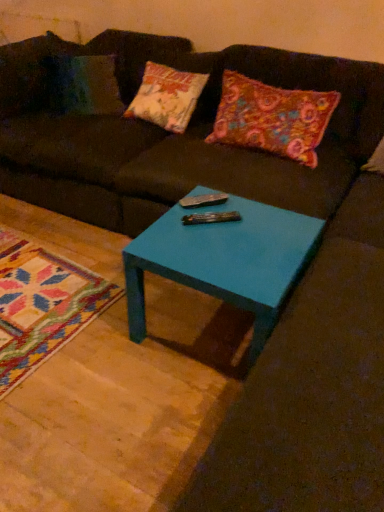
Question: From a real-world perspective, is metallic silver remote at center located beneath matte brown couch at center?

Choices:
 (A) yes
 (B) no

Answer: (B)

Question: Is metallic silver remote at center turned away from matte brown couch at center?

Choices:
 (A) yes
 (B) no

Answer: (A)

Question: Is there a large distance between metallic silver remote at center and matte brown couch at center?

Choices:
 (A) yes
 (B) no

Answer: (B)

Question: From the image's perspective, would you say metallic silver remote at center is shown under matte brown couch at center?

Choices:
 (A) no
 (B) yes

Answer: (B)

Question: Is metallic silver remote at center smaller than matte brown couch at center?

Choices:
 (A) yes
 (B) no

Answer: (A)

Question: Is point (165, 153) closer or farther from the camera than point (135, 266)?

Choices:
 (A) farther
 (B) closer

Answer: (A)

Question: Looking at their shapes, would you say matte brown couch at center is wider or thinner than teal glossy table at center?

Choices:
 (A) wide
 (B) thin

Answer: (A)

Question: From the image's perspective, is matte brown couch at center located above or below teal glossy table at center?

Choices:
 (A) above
 (B) below

Answer: (A)

Question: Is matte brown couch at center in front of or behind teal glossy table at center in the image?

Choices:
 (A) front
 (B) behind

Answer: (B)

Question: Considering the positions of teal glossy table at center and matte brown couch at center in the image, is teal glossy table at center taller or shorter than matte brown couch at center?

Choices:
 (A) short
 (B) tall

Answer: (A)

Question: Do you think teal glossy table at center is within matte brown couch at center, or outside of it?

Choices:
 (A) outside
 (B) inside

Answer: (A)

Question: From the image's perspective, is teal glossy table at center above or below matte brown couch at center?

Choices:
 (A) below
 (B) above

Answer: (A)

Question: Considering the positions of teal glossy table at center and matte brown couch at center in the image, is teal glossy table at center bigger or smaller than matte brown couch at center?

Choices:
 (A) big
 (B) small

Answer: (B)

Question: From a real-world perspective, relative to teal glossy table at center, is metallic silver remote at center vertically above or below?

Choices:
 (A) above
 (B) below

Answer: (A)

Question: Is metallic silver remote at center inside the boundaries of teal glossy table at center, or outside?

Choices:
 (A) outside
 (B) inside

Answer: (B)